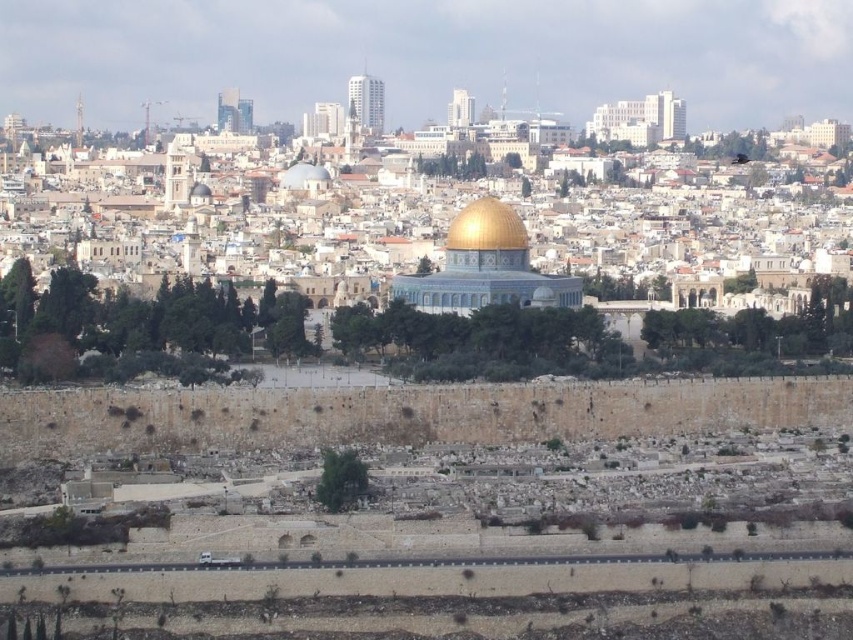
You are standing in the city and want to locate the gold shiny dome at center. According to the coordinates given, where should you look?

The gold shiny dome at center is located at coordinates point (x=486, y=227).

You are an architect analyzing the cityscape. You notice two prominent domes in the image. Which dome, the gold shiny dome at center or the white marble dome at center, is taller?

The gold shiny dome at center is taller than the white marble dome at center.